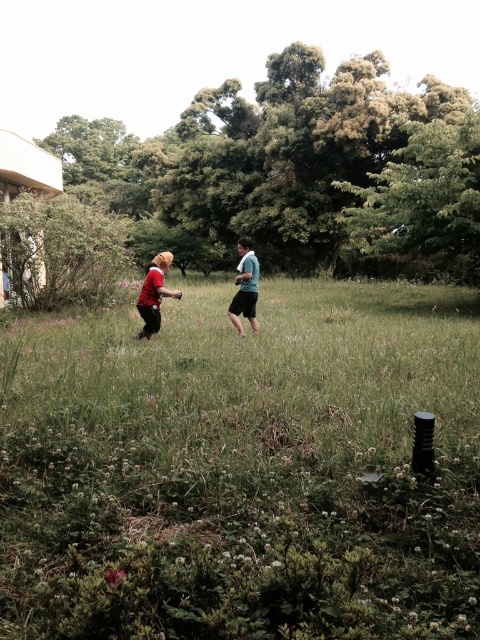
You are standing at the origin point of the coordinate system in the image. The image has a coordinate system where the bottom left corner is the origin. You want to find the matte blue shirt at center. In which direction should you move to reach it?

The matte blue shirt at center is located at coordinate point 0.448 in the x direction and 0.510 in the y direction. Since the origin is at the bottom left corner, moving right along the x axis and up along the y axis will reach the matte blue shirt at center.